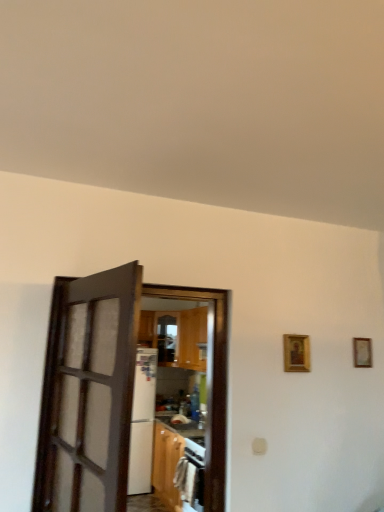
Question: From a real-world perspective, does dark wood door at left, the 1th door from the front, stand above gold-framed picture at upper right, which is the second picture frame in right-to-left order?

Choices:
 (A) yes
 (B) no

Answer: (B)

Question: Can you confirm if dark wood door at left, the 1th door from the front, is positioned to the left of gold-framed picture at upper right, the 2th picture frame when ordered from back to front?

Choices:
 (A) yes
 (B) no

Answer: (A)

Question: Is dark wood door at left, arranged as the 2th door when viewed from the back, thinner than gold-framed picture at upper right, the first picture frame in the left-to-right sequence?

Choices:
 (A) yes
 (B) no

Answer: (B)

Question: Does dark wood door at left, arranged as the 2th door when viewed from the back, lie in front of gold-framed picture at upper right, which ranks as the first picture frame in front-to-back order?

Choices:
 (A) no
 (B) yes

Answer: (B)

Question: Is dark wood door at left, the 1th door from the front, positioned far away from gold-framed picture at upper right, which is the second picture frame in right-to-left order?

Choices:
 (A) no
 (B) yes

Answer: (B)

Question: From a real-world perspective, is dark wood door at left, the 1th door from the front, positioned under gold-framed picture at upper right, which ranks as the first picture frame in front-to-back order, based on gravity?

Choices:
 (A) yes
 (B) no

Answer: (A)

Question: Is brown wooden door at center, which is counted as the first door, starting from the back, directly adjacent to gold-framed picture at right, the 2th picture frame from the left?

Choices:
 (A) yes
 (B) no

Answer: (B)

Question: Considering the relative sizes of brown wooden door at center, which is counted as the first door, starting from the back, and gold-framed picture at right, the 1th picture frame viewed from the back, in the image provided, is brown wooden door at center, which is counted as the first door, starting from the back, taller than gold-framed picture at right, the 1th picture frame viewed from the back,?

Choices:
 (A) yes
 (B) no

Answer: (A)

Question: Is brown wooden door at center, the second door in the front-to-back sequence, behind gold-framed picture at right, the 1th picture frame viewed from the back?

Choices:
 (A) yes
 (B) no

Answer: (B)

Question: Does brown wooden door at center, which is counted as the first door, starting from the back, have a lesser width compared to gold-framed picture at right, which is the first picture frame in right-to-left order?

Choices:
 (A) no
 (B) yes

Answer: (A)

Question: Considering the relative positions of brown wooden door at center, the second door in the front-to-back sequence, and gold-framed picture at right, the 2th picture frame in the front-to-back sequence, in the image provided, is brown wooden door at center, the second door in the front-to-back sequence, to the right of gold-framed picture at right, the 2th picture frame in the front-to-back sequence, from the viewer's perspective?

Choices:
 (A) yes
 (B) no

Answer: (B)

Question: Is brown wooden door at center, the second door in the front-to-back sequence, completely or partially outside of gold-framed picture at right, the 2th picture frame from the left?

Choices:
 (A) no
 (B) yes

Answer: (B)

Question: Can you confirm if gold-framed picture at upper right, the first picture frame in the left-to-right sequence, is thinner than gold-framed picture at right, the 2th picture frame in the front-to-back sequence?

Choices:
 (A) no
 (B) yes

Answer: (A)